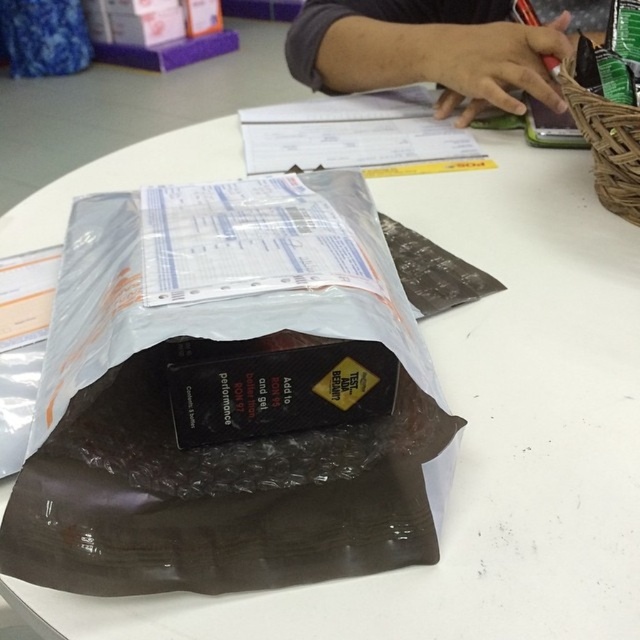
You are organizing items on a table and need to place the dark gray skin at upper center and the woven brown basket at upper right. Based on their sizes, which one should you place first to ensure stability?

The dark gray skin at upper center should be placed first because it has a greater height compared to the woven brown basket at upper right, ensuring stability by placing the taller item first.

You are a delivery person who needs to check the distance between your hand and the dark gray skin at upper center. Can you reach it without moving your body?

The dark gray skin at upper center is 30.26 inches away from you, so you cannot reach it without moving your body since the typical arm length is shorter than that distance.

You are an assistant organizing items on a table. You need to place a new item between the dark gray skin at upper center and the woven brown basket at upper right. Which object should be closer to you when placing the new item?

The dark gray skin at upper center is closer to you than the woven brown basket at upper right, so the new item should be placed closer to the dark gray skin at upper center.